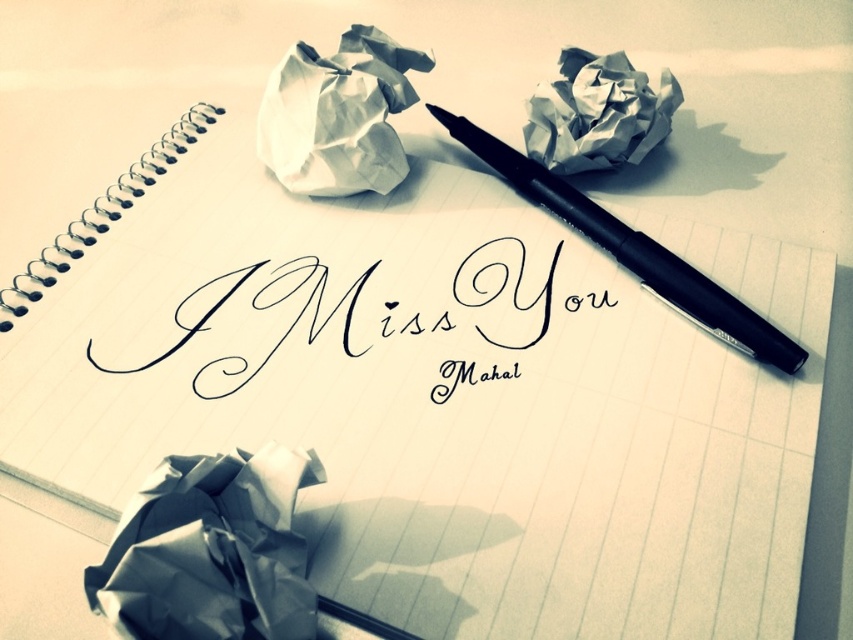
Question: Is the position of black calligraphy at center more distant than that of white crumpled paper at upper center?

Choices:
 (A) yes
 (B) no

Answer: (B)

Question: Which point is farther to the camera?

Choices:
 (A) (264, 145)
 (B) (712, 305)
 (C) (126, 371)

Answer: (A)

Question: Among these objects, which one is nearest to the camera?

Choices:
 (A) black matte pen at center
 (B) black calligraphy at center
 (C) white crumpled paper at upper center

Answer: (A)

Question: Among these objects, which one is nearest to the camera?

Choices:
 (A) white crumpled paper at upper center
 (B) black calligraphy at center
 (C) black matte pen at center

Answer: (C)

Question: Is black calligraphy at center closer to the viewer compared to black matte pen at center?

Choices:
 (A) no
 (B) yes

Answer: (A)

Question: Does black calligraphy at center have a larger size compared to white crumpled paper at upper center?

Choices:
 (A) no
 (B) yes

Answer: (B)